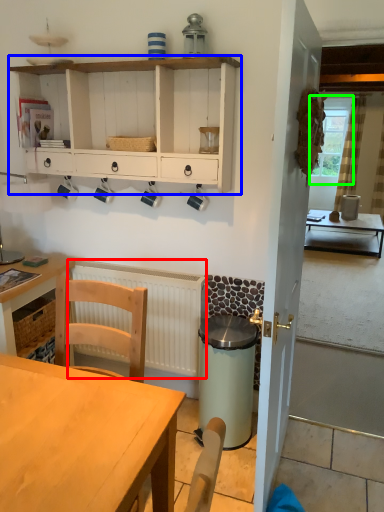
Question: Which object is the farthest from radiator (highlighted by a red box)? Choose among these: cabinetry (highlighted by a blue box) or window screen (highlighted by a green box).

Choices:
 (A) cabinetry
 (B) window screen

Answer: (B)